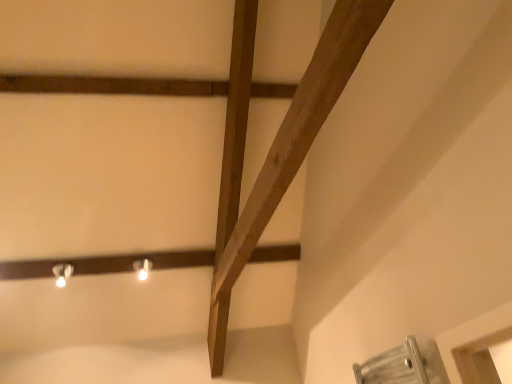
Identify the location of white glossy light fixture at upper left, which is the 2th light fixture from right to left. Image resolution: width=512 pixels, height=384 pixels. (62, 273).

What is the approximate width of white glossy light fixture at upper left, which is the 2th light fixture from right to left?

The width of white glossy light fixture at upper left, which is the 2th light fixture from right to left, is 4.53 inches.

What do you see at coordinates (62, 273) in the screenshot?
I see `white glossy light fixture at upper left, the 1th light fixture positioned from the left` at bounding box center [62, 273].

This screenshot has width=512, height=384. I want to click on matte white bulb at upper center, the 1th light fixture from the right, so click(142, 268).

What do you see at coordinates (142, 268) in the screenshot?
I see `matte white bulb at upper center, positioned as the second light fixture in left-to-right order` at bounding box center [142, 268].

This screenshot has height=384, width=512. Identify the location of white glossy light fixture at upper left, the 1th light fixture positioned from the left. (62, 273).

Considering the relative positions of matte white bulb at upper center, the 1th light fixture from the right, and white glossy light fixture at upper left, the 1th light fixture positioned from the left, in the image provided, is matte white bulb at upper center, the 1th light fixture from the right, to the left or to the right of white glossy light fixture at upper left, the 1th light fixture positioned from the left,?

Based on their positions, matte white bulb at upper center, the 1th light fixture from the right, is located to the right of white glossy light fixture at upper left, the 1th light fixture positioned from the left.

Does matte white bulb at upper center, the 1th light fixture from the right, lie behind white glossy light fixture at upper left, which is the 2th light fixture from right to left?

Yes, matte white bulb at upper center, the 1th light fixture from the right, is further from the camera.

Which is closer to the camera, (140, 271) or (67, 277)?

Point (140, 271).

From the image's perspective, is matte white bulb at upper center, the 1th light fixture from the right, over white glossy light fixture at upper left, which is the 2th light fixture from right to left?

Indeed, from the image's perspective, matte white bulb at upper center, the 1th light fixture from the right, is shown above white glossy light fixture at upper left, which is the 2th light fixture from right to left.

From a real-world perspective, is matte white bulb at upper center, the 1th light fixture from the right, physically above white glossy light fixture at upper left, the 1th light fixture positioned from the left?

Incorrect, from a real-world perspective, matte white bulb at upper center, the 1th light fixture from the right, is lower than white glossy light fixture at upper left, the 1th light fixture positioned from the left.

Is matte white bulb at upper center, the 1th light fixture from the right, thinner than white glossy light fixture at upper left, the 1th light fixture positioned from the left?

Yes, matte white bulb at upper center, the 1th light fixture from the right, is thinner than white glossy light fixture at upper left, the 1th light fixture positioned from the left.

Between matte white bulb at upper center, the 1th light fixture from the right, and white glossy light fixture at upper left, the 1th light fixture positioned from the left, which one has more height?

white glossy light fixture at upper left, the 1th light fixture positioned from the left, is taller.

Considering the relative sizes of matte white bulb at upper center, the 1th light fixture from the right, and white glossy light fixture at upper left, which is the 2th light fixture from right to left, in the image provided, is matte white bulb at upper center, the 1th light fixture from the right, smaller than white glossy light fixture at upper left, which is the 2th light fixture from right to left,?

Yes, matte white bulb at upper center, the 1th light fixture from the right, is smaller than white glossy light fixture at upper left, which is the 2th light fixture from right to left.

Is matte white bulb at upper center, positioned as the second light fixture in left-to-right order, completely or partially outside of white glossy light fixture at upper left, the 1th light fixture positioned from the left?

Yes, matte white bulb at upper center, positioned as the second light fixture in left-to-right order, is located beyond the bounds of white glossy light fixture at upper left, the 1th light fixture positioned from the left.

Is matte white bulb at upper center, positioned as the second light fixture in left-to-right order, not near white glossy light fixture at upper left, which is the 2th light fixture from right to left?

No.

Could you tell me if matte white bulb at upper center, the 1th light fixture from the right, is facing white glossy light fixture at upper left, which is the 2th light fixture from right to left?

No, matte white bulb at upper center, the 1th light fixture from the right, is not oriented towards white glossy light fixture at upper left, which is the 2th light fixture from right to left.

At what (x,y) coordinates should I click in order to perform the action: click on light fixture that appears below the white glossy light fixture at upper left, the 1th light fixture positioned from the left (from a real-world perspective). Please return your answer as a coordinate pair (x, y). Image resolution: width=512 pixels, height=384 pixels. Looking at the image, I should click on (142, 268).

Is white glossy light fixture at upper left, which is the 2th light fixture from right to left, at the left side of matte white bulb at upper center, the 1th light fixture from the right?

Indeed, white glossy light fixture at upper left, which is the 2th light fixture from right to left, is positioned on the left side of matte white bulb at upper center, the 1th light fixture from the right.

Relative to matte white bulb at upper center, positioned as the second light fixture in left-to-right order, is white glossy light fixture at upper left, the 1th light fixture positioned from the left, in front or behind?

In the image, white glossy light fixture at upper left, the 1th light fixture positioned from the left, appears in front of matte white bulb at upper center, positioned as the second light fixture in left-to-right order.

Considering the positions of point (54, 275) and point (134, 269), is point (54, 275) closer or farther from the camera than point (134, 269)?

Point (54, 275).

From the image's perspective, is white glossy light fixture at upper left, the 1th light fixture positioned from the left, beneath matte white bulb at upper center, the 1th light fixture from the right?

Indeed, from the image's perspective, white glossy light fixture at upper left, the 1th light fixture positioned from the left, is shown beneath matte white bulb at upper center, the 1th light fixture from the right.

From a real-world perspective, relative to matte white bulb at upper center, the 1th light fixture from the right, is white glossy light fixture at upper left, the 1th light fixture positioned from the left, vertically above or below?

Clearly, from a real-world perspective, white glossy light fixture at upper left, the 1th light fixture positioned from the left, is above matte white bulb at upper center, the 1th light fixture from the right.

Can you confirm if white glossy light fixture at upper left, which is the 2th light fixture from right to left, is wider than matte white bulb at upper center, the 1th light fixture from the right?

Yes, white glossy light fixture at upper left, which is the 2th light fixture from right to left, is wider than matte white bulb at upper center, the 1th light fixture from the right.

Does white glossy light fixture at upper left, which is the 2th light fixture from right to left, have a greater height compared to matte white bulb at upper center, positioned as the second light fixture in left-to-right order?

Yes.

In the scene shown: Can you confirm if white glossy light fixture at upper left, which is the 2th light fixture from right to left, is bigger than matte white bulb at upper center, positioned as the second light fixture in left-to-right order?

Yes, white glossy light fixture at upper left, which is the 2th light fixture from right to left, is bigger than matte white bulb at upper center, positioned as the second light fixture in left-to-right order.

Is white glossy light fixture at upper left, the 1th light fixture positioned from the left, spatially inside matte white bulb at upper center, the 1th light fixture from the right, or outside of it?

white glossy light fixture at upper left, the 1th light fixture positioned from the left, is outside matte white bulb at upper center, the 1th light fixture from the right.

Is white glossy light fixture at upper left, which is the 2th light fixture from right to left, far away from matte white bulb at upper center, the 1th light fixture from the right?

white glossy light fixture at upper left, which is the 2th light fixture from right to left, is near matte white bulb at upper center, the 1th light fixture from the right, not far away.

Is white glossy light fixture at upper left, the 1th light fixture positioned from the left, oriented away from matte white bulb at upper center, positioned as the second light fixture in left-to-right order?

No, white glossy light fixture at upper left, the 1th light fixture positioned from the left, is not facing the opposite direction of matte white bulb at upper center, positioned as the second light fixture in left-to-right order.

This screenshot has height=384, width=512. I want to click on light fixture on the left side of matte white bulb at upper center, the 1th light fixture from the right, so click(62, 273).

This screenshot has height=384, width=512. There is a matte white bulb at upper center, positioned as the second light fixture in left-to-right order. In order to click on light fixture above it (from a real-world perspective) in this screenshot , I will do pyautogui.click(x=62, y=273).

Identify the location of light fixture above the white glossy light fixture at upper left, which is the 2th light fixture from right to left (from the image's perspective). The image size is (512, 384). (142, 268).